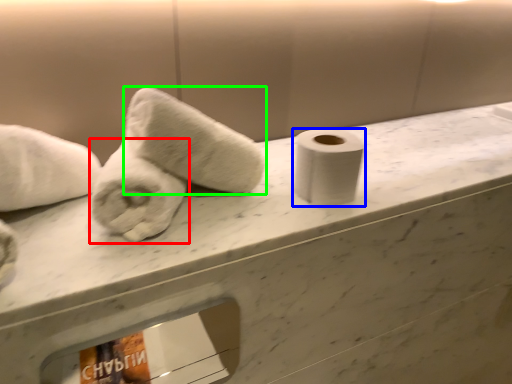
Question: Considering the real-world distances, which object is farthest from towel (highlighted by a red box)? toilet paper (highlighted by a blue box) or towel (highlighted by a green box)?

Choices:
 (A) toilet paper
 (B) towel

Answer: (A)